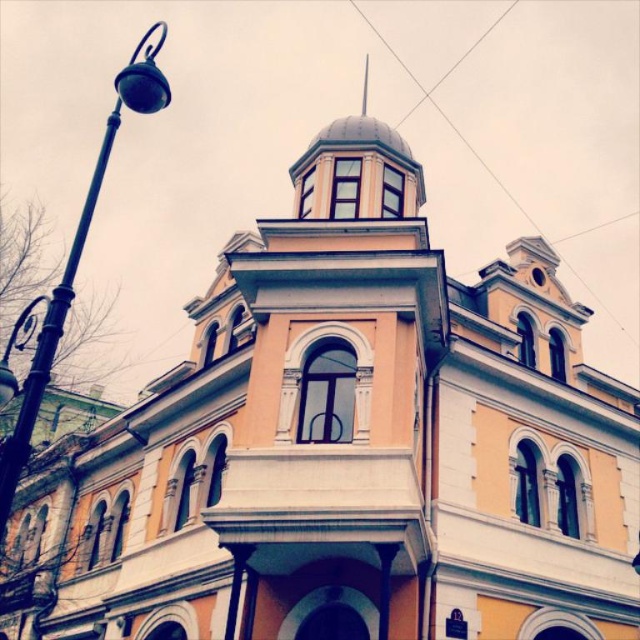
You are an architect analyzing the building facade. You need to determine which object has a greater horizontal extent between the black metal lamp post at left and the smooth white spire at upper center. Which one is wider?

The black metal lamp post at left has a larger width than the smooth white spire at upper center, so the black metal lamp post at left is wider.

Consider the image. You are standing in front of the building and notice two points on its facade. The first point is located at coordinates point (83, 216), and the second is at point (368, 77). Which of these two points is closer to your current position?

Point (83, 216) is closer to the viewer than point (368, 77).